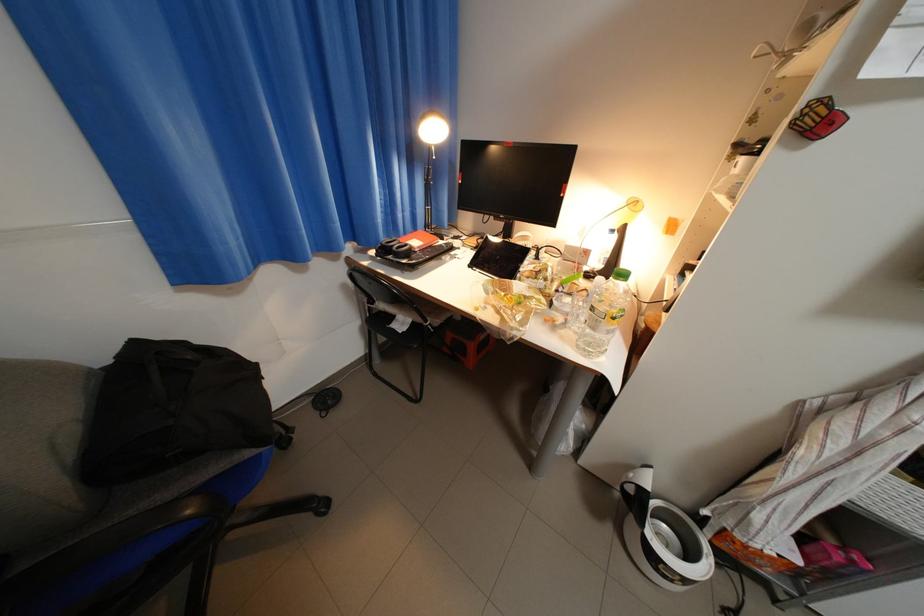
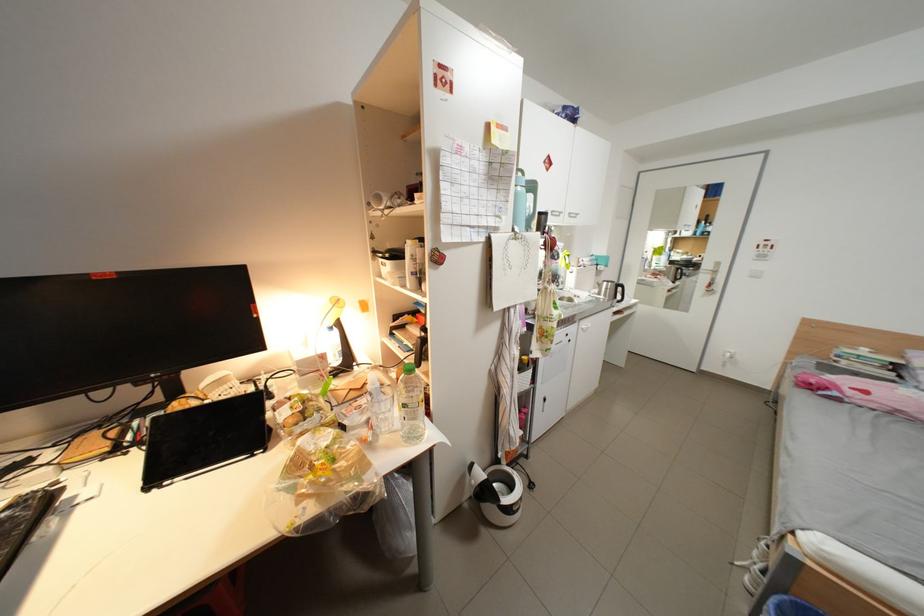
The point at (599, 254) is marked in the first image. Where is the corresponding point in the second image?

(334, 358)